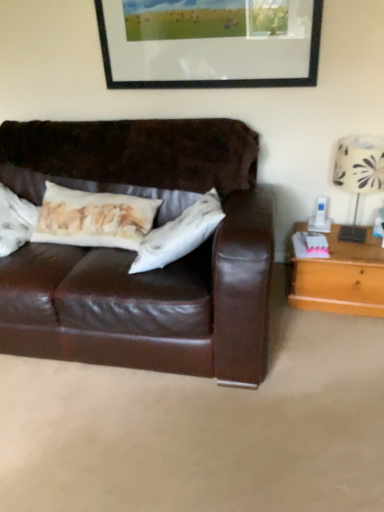
Question: Is point (362, 178) closer or farther from the camera than point (150, 69)?

Choices:
 (A) closer
 (B) farther

Answer: (A)

Question: Is white fabric lampshade at right spatially inside black matte picture frame at upper center, or outside of it?

Choices:
 (A) outside
 (B) inside

Answer: (A)

Question: Which object is positioned farthest from the light brown wooden table at right?

Choices:
 (A) black matte picture frame at upper center
 (B) white fabric lampshade at right

Answer: (A)

Question: Which object is the closest to the black matte picture frame at upper center?

Choices:
 (A) white fabric lampshade at right
 (B) light brown wooden table at right

Answer: (A)